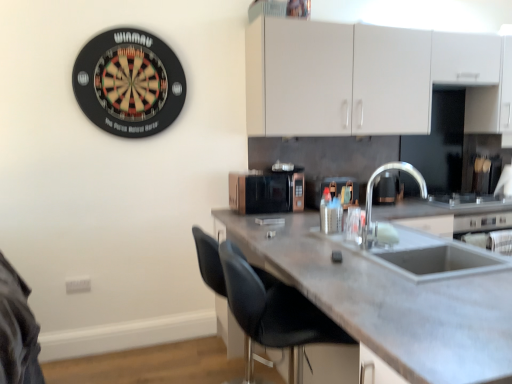
Locate an element on the screen. concrete gray countertop at center is located at coordinates (396, 294).

You are a GUI agent. You are given a task and a screenshot of the screen. Output one action in this format:
    pyautogui.click(x=<x>, y=<y>)
    Task: Click on the black leather chair at lower center
    The image size is (512, 384).
    Given the screenshot: What is the action you would take?
    pyautogui.click(x=274, y=312)

Does black leather chair at lower center come behind satin nickel faucet at sink right?

No, it is in front of satin nickel faucet at sink right.

Is point (315, 335) farther from viewer compared to point (369, 191)?

No, it is not.

Find the location of `chair lying on the left of satin nickel faucet at sink right`. chair lying on the left of satin nickel faucet at sink right is located at coordinates (274, 312).

Does black leather chair at lower center have a greater height compared to satin nickel faucet at sink right?

Yes, black leather chair at lower center is taller than satin nickel faucet at sink right.

Does white matte cabinet at upper center have a greater width compared to concrete gray countertop at center?

Incorrect, the width of white matte cabinet at upper center does not surpass that of concrete gray countertop at center.

Is white matte cabinet at upper center aimed at concrete gray countertop at center?

No, white matte cabinet at upper center is not turned towards concrete gray countertop at center.

From a real-world perspective, is white matte cabinet at upper center positioned under concrete gray countertop at center based on gravity?

No, from a real-world perspective, white matte cabinet at upper center is not beneath concrete gray countertop at center.

Are satin nickel faucet at sink right and concrete gray countertop at center far apart?

Absolutely, satin nickel faucet at sink right is distant from concrete gray countertop at center.

Does satin nickel faucet at sink right have a larger size compared to concrete gray countertop at center?

Incorrect, satin nickel faucet at sink right is not larger than concrete gray countertop at center.

Is satin nickel faucet at sink right facing away from concrete gray countertop at center?

That's not correct — satin nickel faucet at sink right is not looking away from concrete gray countertop at center.

Is concrete gray countertop at center smaller than satin nickel faucet at sink right?

Actually, concrete gray countertop at center might be larger than satin nickel faucet at sink right.

Relative to satin nickel faucet at sink right, is concrete gray countertop at center in front or behind?

concrete gray countertop at center is positioned closer to the viewer than satin nickel faucet at sink right.

From the image's perspective, which is below, concrete gray countertop at center or satin nickel faucet at sink right?

concrete gray countertop at center, from the image's perspective.

Is metallic silver container at center, which is counted as the 2th appliance, starting from the left, facing away from satin nickel faucet at sink right?

That's not correct — metallic silver container at center, which is counted as the 2th appliance, starting from the left, is not looking away from satin nickel faucet at sink right.

From the image's perspective, which is below, metallic silver container at center, positioned as the 1th appliance in right-to-left order, or satin nickel faucet at sink right?

satin nickel faucet at sink right.

Looking at this image, would you say metallic silver container at center, positioned as the 1th appliance in right-to-left order, contains satin nickel faucet at sink right?

No, metallic silver container at center, positioned as the 1th appliance in right-to-left order, does not contain satin nickel faucet at sink right.

Can you confirm if metallic silver container at center, which is counted as the 2th appliance, starting from the left, is shorter than satin nickel faucet at sink right?

Yes, metallic silver container at center, which is counted as the 2th appliance, starting from the left, is shorter than satin nickel faucet at sink right.

Is rose gold metallic microwave at center, the 1th appliance in the left-to-right sequence, positioned behind satin nickel faucet at sink right?

Yes, the depth of rose gold metallic microwave at center, the 1th appliance in the left-to-right sequence, is greater than that of satin nickel faucet at sink right.

Is rose gold metallic microwave at center, the 1th appliance in the left-to-right sequence, facing away from satin nickel faucet at sink right?

No.

Considering the sizes of objects rose gold metallic microwave at center, which is the 2th appliance in right-to-left order, and satin nickel faucet at sink right in the image provided, who is taller, rose gold metallic microwave at center, which is the 2th appliance in right-to-left order, or satin nickel faucet at sink right?

With more height is satin nickel faucet at sink right.

In terms of width, does concrete gray countertop at center look wider or thinner when compared to white matte cabinet at upper center?

concrete gray countertop at center is wider than white matte cabinet at upper center.

From a real-world perspective, between concrete gray countertop at center and white matte cabinet at upper center, who is vertically lower?

From a 3D spatial view, concrete gray countertop at center is below.

Consider the image. Which of these two, concrete gray countertop at center or white matte cabinet at upper center, stands taller?

With more height is concrete gray countertop at center.

This screenshot has width=512, height=384. Identify the location of tap above the black leather chair at lower center (from the image's perspective). (372, 192).

Find the location of a particular element. Image resolution: width=512 pixels, height=384 pixels. cabinetry above the concrete gray countertop at center (from a real-world perspective) is located at coordinates (362, 78).

Which object lies nearer to the anchor point white matte cabinet at upper center, concrete gray countertop at center or satin nickel faucet at sink right?

Based on the image, satin nickel faucet at sink right appears to be nearer to white matte cabinet at upper center.

Looking at the image, which one is located closer to rose gold metallic microwave at center, which is the 2th appliance in right-to-left order, black leather chair at lower center or metallic silver container at center, which is counted as the 2th appliance, starting from the left?

The object closer to rose gold metallic microwave at center, which is the 2th appliance in right-to-left order, is metallic silver container at center, which is counted as the 2th appliance, starting from the left.

Considering their positions, is metallic silver container at center, positioned as the 1th appliance in right-to-left order, positioned further to rose gold metallic microwave at center, which is the 2th appliance in right-to-left order, than concrete gray countertop at center?

Among the two, concrete gray countertop at center is located further to rose gold metallic microwave at center, which is the 2th appliance in right-to-left order.

Looking at the image, which one is located closer to black leather chair at lower center, metallic silver container at center, which is counted as the 2th appliance, starting from the left, or white matte cabinet at upper center?

metallic silver container at center, which is counted as the 2th appliance, starting from the left.

From the image, which object appears to be farther from metallic silver container at center, positioned as the 1th appliance in right-to-left order, white matte cabinet at upper center or black leather chair at lower center?

black leather chair at lower center is positioned further to the anchor metallic silver container at center, positioned as the 1th appliance in right-to-left order.

In the scene shown: When comparing their distances from black leather chair at lower center, does metallic silver container at center, positioned as the 1th appliance in right-to-left order, or concrete gray countertop at center seem closer?

concrete gray countertop at center lies closer to black leather chair at lower center than the other object.

Looking at the image, which one is located closer to satin nickel faucet at sink right, concrete gray countertop at center or black leather chair at lower center?

Among the two, concrete gray countertop at center is located nearer to satin nickel faucet at sink right.

Estimate the real-world distances between objects in this image. Which object is closer to satin nickel faucet at sink right, white matte cabinet at upper center or concrete gray countertop at center?

The object closer to satin nickel faucet at sink right is white matte cabinet at upper center.

This screenshot has height=384, width=512. I want to click on tap between white matte cabinet at upper center and black leather chair at lower center in the vertical direction, so click(372, 192).

Identify the location of cabinetry located between concrete gray countertop at center and rose gold metallic microwave at center, which is the 2th appliance in right-to-left order, in the depth direction. (362, 78).

Where is `appliance located between rose gold metallic microwave at center, the 1th appliance in the left-to-right sequence, and white matte cabinet at upper center in the left-right direction`? appliance located between rose gold metallic microwave at center, the 1th appliance in the left-to-right sequence, and white matte cabinet at upper center in the left-right direction is located at coordinates (342, 189).

At what (x,y) coordinates should I click in order to perform the action: click on appliance located between black leather chair at lower center and metallic silver container at center, positioned as the 1th appliance in right-to-left order, in the depth direction. Please return your answer as a coordinate pair (x, y). Image resolution: width=512 pixels, height=384 pixels. Looking at the image, I should click on (267, 191).